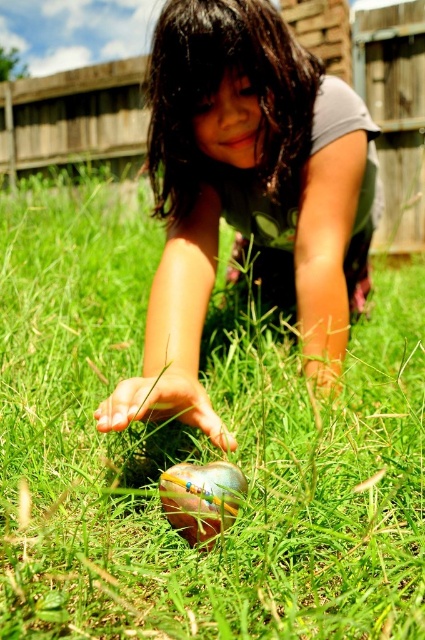
You are a photographer setting up a shot of the matte green dress at center and the shiny metallic ball at center. You need to ensure that both objects are fully visible in the frame. Given that the dress is wider than the ball, which object should you position closer to the camera to maintain their sizes in the photo?

Since the matte green dress at center is wider than the shiny metallic ball at center, you should position the shiny metallic ball at center closer to the camera to ensure both appear similarly sized in the photo.

Consider the image. The girl is wearing a matte green dress at center and is reaching for a shiny metallic ball at center. Which object is located to the left of the other?

The shiny metallic ball at center is located to the left of the matte green dress at center.